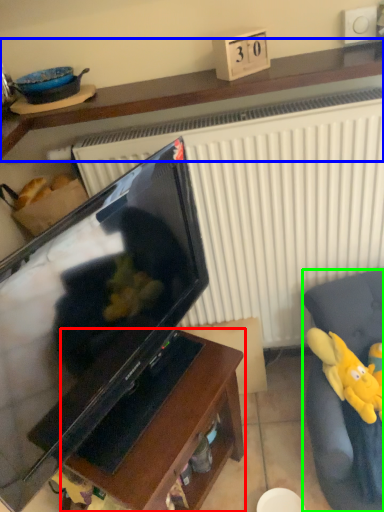
Question: Based on their relative distances, which object is farther from furniture (highlighted by a red box)? Choose from furniture (highlighted by a blue box) and furniture (highlighted by a green box).

Choices:
 (A) furniture
 (B) furniture

Answer: (A)